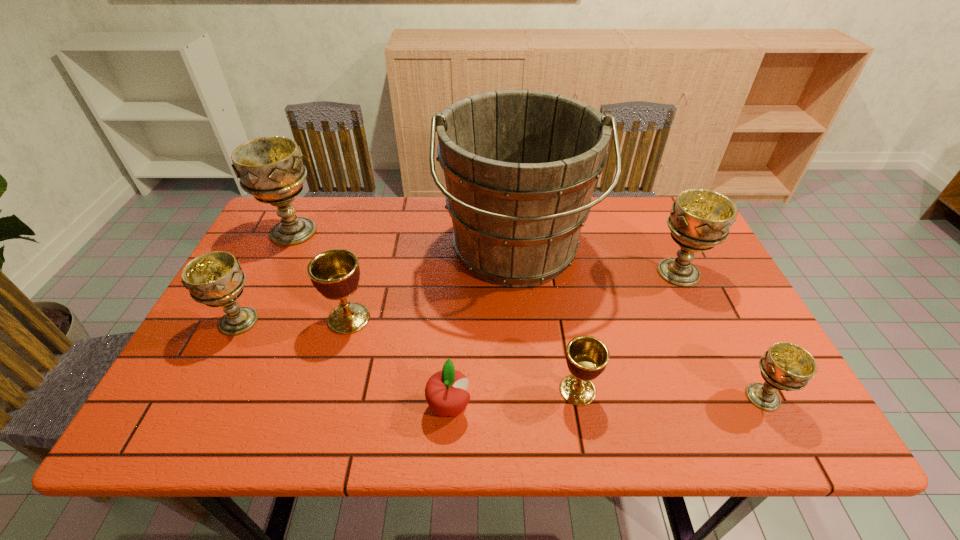
Where is `vacant area at the near right corner`? This screenshot has width=960, height=540. vacant area at the near right corner is located at coordinates (754, 407).

Identify the location of vacant area that lies between the bigger golden chalice and the shortest object. This screenshot has width=960, height=540. (399, 363).

Identify the location of vacant area that lies between the smallest white chalice and the bucket. (638, 323).

This screenshot has height=540, width=960. In order to click on vacant area that lies between the second farthest white chalice and the smallest white chalice in this screenshot , I will do `click(721, 335)`.

Identify the location of free spot between the third object from left to right and the apple. Image resolution: width=960 pixels, height=540 pixels. [399, 363].

Identify the location of vacant region between the shortest object and the bucket. (482, 329).

The image size is (960, 540). Identify the location of free spot between the smaller golden chalice and the nearest white chalice. (670, 394).

This screenshot has height=540, width=960. What are the coordinates of `vacant point located between the right golden chalice and the red apple` in the screenshot? It's located at (514, 399).

This screenshot has height=540, width=960. What are the coordinates of `vacant space that's between the bigger golden chalice and the sixth shortest object` in the screenshot? It's located at (514, 295).

Locate an element on the screen. This screenshot has height=540, width=960. blank region between the smaller golden chalice and the tallest object is located at coordinates (546, 320).